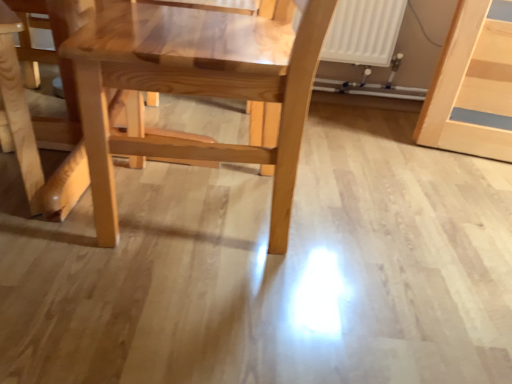
Find the location of a particular element. The width and height of the screenshot is (512, 384). free spot to the right of natural wood chair at center is located at coordinates (393, 279).